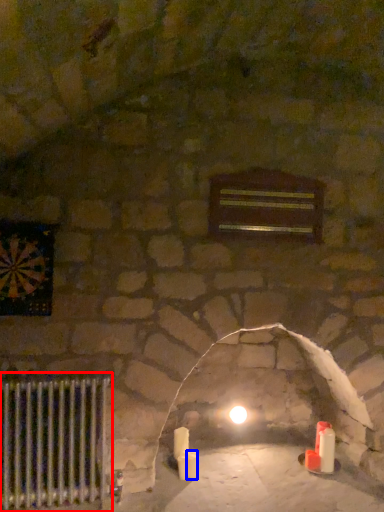
Question: Which point is further to the camera, radiator (highlighted by a red box) or candle (highlighted by a blue box)?

Choices:
 (A) radiator
 (B) candle

Answer: (B)